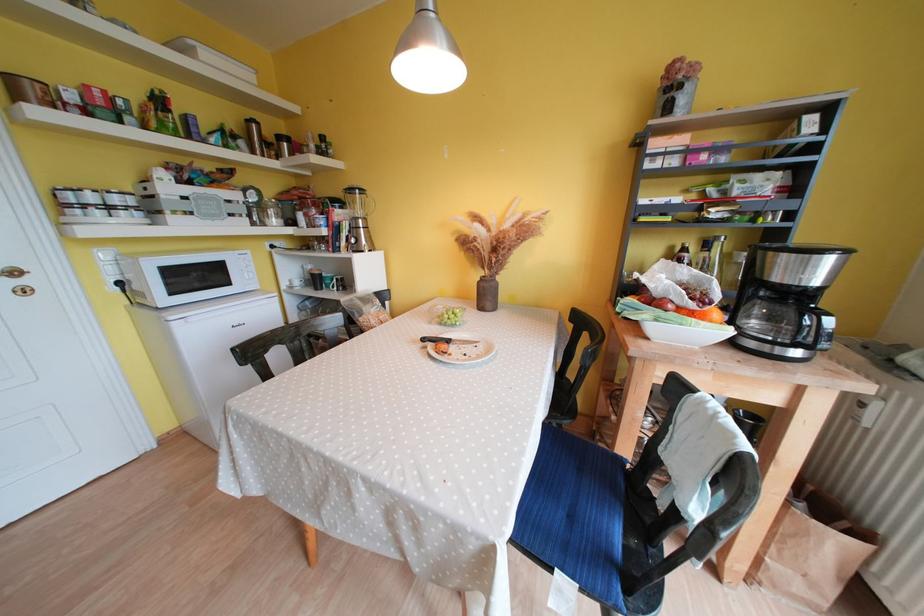
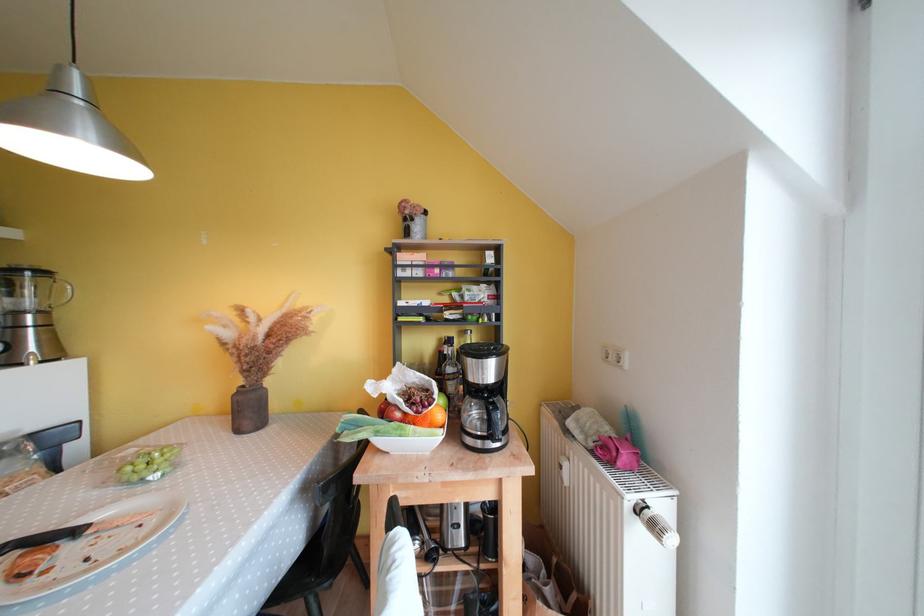
Find the pixel in the second image that matches point (677, 252) in the first image.

(446, 342)